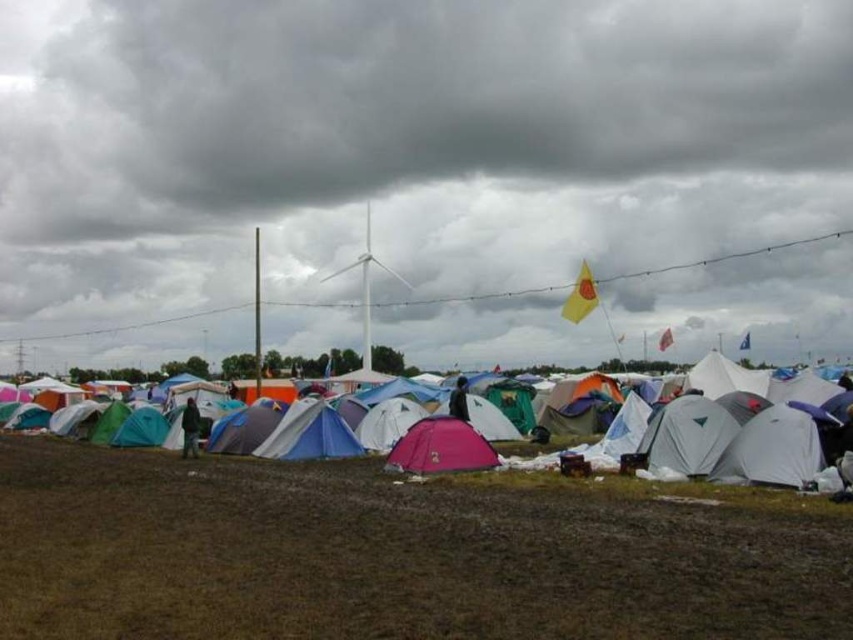
Question: Does multicolored fabric tents at center appear on the left side of white matte wind turbine at center?

Choices:
 (A) yes
 (B) no

Answer: (B)

Question: Estimate the real-world distances between objects in this image. Which object is farther from the brown grassy field at lower center?

Choices:
 (A) pink fabric tent at center
 (B) white matte wind turbine at center

Answer: (B)

Question: Is multicolored fabric tents at center further to camera compared to pink fabric tent at center?

Choices:
 (A) no
 (B) yes

Answer: (A)

Question: Does multicolored fabric tents at center appear over pink fabric tent at center?

Choices:
 (A) yes
 (B) no

Answer: (A)

Question: Which of the following is the farthest from the observer?

Choices:
 (A) (817, 468)
 (B) (170, 465)
 (C) (366, 321)
 (D) (473, 444)

Answer: (C)

Question: Among these points, which one is farthest from the camera?

Choices:
 (A) (780, 419)
 (B) (461, 420)
 (C) (585, 512)

Answer: (B)